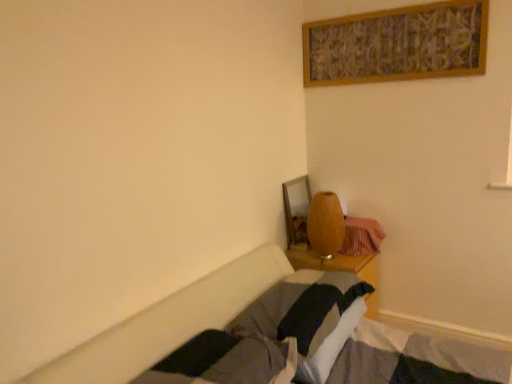
Describe the element at coordinates (325, 224) in the screenshot. I see `matte yellow lamp at center` at that location.

This screenshot has width=512, height=384. I want to click on plaid fabric blanket at lower right, so click(x=361, y=236).

Find the location of a particular element. matte yellow lamp at center is located at coordinates (325, 224).

Would you say plaid fabric blanket at lower right is to the left or to the right of soft gray pillow at center in the picture?

plaid fabric blanket at lower right is positioned on soft gray pillow at center's right side.

Does point (365, 236) appear closer or farther from the camera than point (347, 309)?

Point (365, 236) appears to be farther away from the viewer than point (347, 309).

Does plaid fabric blanket at lower right touch soft gray pillow at center?

They are not placed beside each other.

Is plaid fabric blanket at lower right taller than soft gray pillow at center?

Yes, plaid fabric blanket at lower right is taller than soft gray pillow at center.

From a real-world perspective, is matte yellow lamp at center on top of soft gray pillow at center?

Yes.

What's the angular difference between matte yellow lamp at center and soft gray pillow at center's facing directions?

The angle between the facing direction of matte yellow lamp at center and the facing direction of soft gray pillow at center is 2.27 degrees.

Is matte yellow lamp at center thinner than soft gray pillow at center?

Yes, matte yellow lamp at center is thinner than soft gray pillow at center.

Is matte yellow lamp at center completely or partially inside soft gray pillow at center?

Definitely not — matte yellow lamp at center is not inside soft gray pillow at center.

Is soft gray pillow at center wider than matte yellow lamp at center?

Yes, soft gray pillow at center is wider than matte yellow lamp at center.

Can you tell me how much soft gray pillow at center and matte yellow lamp at center differ in facing direction?

The angular difference between soft gray pillow at center and matte yellow lamp at center is 2.27 degrees.

What's the angular difference between matte yellow lamp at center and plaid fabric blanket at lower right's facing directions?

matte yellow lamp at center and plaid fabric blanket at lower right are facing 0.00259 degrees away from each other.

Is point (321, 221) closer or farther from the camera than point (365, 220)?

Point (321, 221) is positioned closer to the camera compared to point (365, 220).

Who is more distant, matte yellow lamp at center or plaid fabric blanket at lower right?

plaid fabric blanket at lower right is further from the camera.

From the image's perspective, would you say matte yellow lamp at center is shown under plaid fabric blanket at lower right?

No.

Is plaid fabric blanket at lower right wider or thinner than matte yellow lamp at center?

Clearly, plaid fabric blanket at lower right has more width compared to matte yellow lamp at center.

Is matte yellow lamp at center a part of plaid fabric blanket at lower right?

No, plaid fabric blanket at lower right does not contain matte yellow lamp at center.

Is the depth of plaid fabric blanket at lower right greater than that of matte yellow lamp at center?

Yes, it is behind matte yellow lamp at center.

From the image's perspective, is plaid fabric blanket at lower right beneath matte yellow lamp at center?

Yes, from the image's perspective, plaid fabric blanket at lower right is beneath matte yellow lamp at center.

Would you say soft gray pillow at center is inside or outside plaid fabric blanket at lower right?

soft gray pillow at center is spatially situated outside plaid fabric blanket at lower right.

Is soft gray pillow at center to the right of plaid fabric blanket at lower right from the viewer's perspective?

No.

From the image's perspective, which is above, soft gray pillow at center or plaid fabric blanket at lower right?

plaid fabric blanket at lower right is shown above in the image.

Is the surface of soft gray pillow at center in direct contact with plaid fabric blanket at lower right?

No, soft gray pillow at center is not touching plaid fabric blanket at lower right.

This screenshot has height=384, width=512. I want to click on blanket positioned vertically above the soft gray pillow at center (from a real-world perspective), so click(361, 236).

Identify the location of pillow that is under the matte yellow lamp at center (from a real-world perspective). The width and height of the screenshot is (512, 384). (308, 317).

Which object lies further to the anchor point plaid fabric blanket at lower right, soft gray pillow at center or matte yellow lamp at center?

soft gray pillow at center is further to plaid fabric blanket at lower right.

Which object lies further to the anchor point matte yellow lamp at center, soft gray pillow at center or plaid fabric blanket at lower right?

soft gray pillow at center.

Estimate the real-world distances between objects in this image. Which object is closer to soft gray pillow at center, plaid fabric blanket at lower right or matte yellow lamp at center?

matte yellow lamp at center.

Based on the photo, when comparing their distances from soft gray pillow at center, does matte yellow lamp at center or plaid fabric blanket at lower right seem closer?

Based on the image, matte yellow lamp at center appears to be nearer to soft gray pillow at center.

From the image, which object appears to be farther from plaid fabric blanket at lower right, matte yellow lamp at center or soft gray pillow at center?

Based on the image, soft gray pillow at center appears to be further to plaid fabric blanket at lower right.

Considering their positions, is plaid fabric blanket at lower right positioned further to matte yellow lamp at center than soft gray pillow at center?

soft gray pillow at center.

Locate an element on the screen. The width and height of the screenshot is (512, 384). lamp between soft gray pillow at center and plaid fabric blanket at lower right along the z-axis is located at coordinates (325, 224).